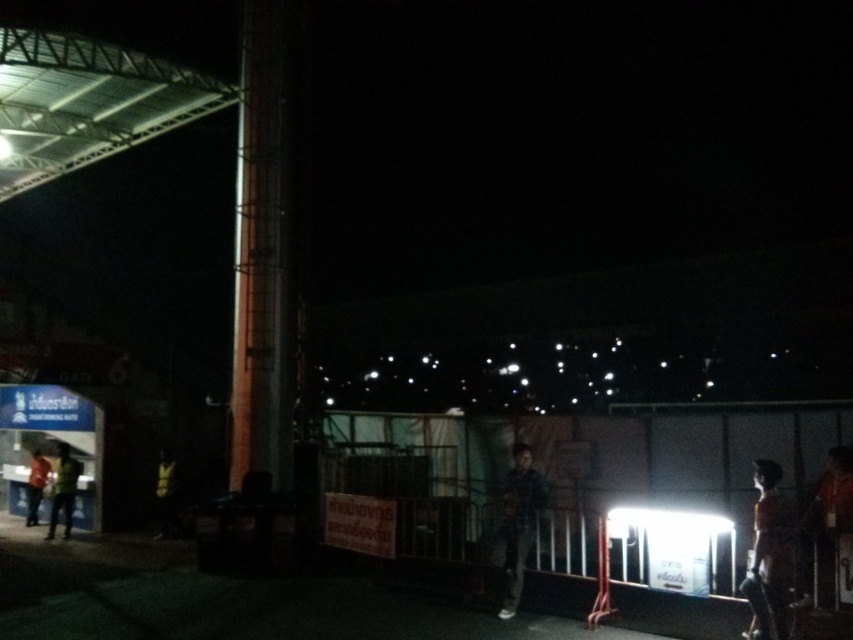
Question: Can you confirm if orange fabric shirt at right is bigger than orange shirt at left?

Choices:
 (A) yes
 (B) no

Answer: (B)

Question: Which object is closer to the camera taking this photo?

Choices:
 (A) blue plastic signboard at lower left
 (B) plaid fabric shirt at center

Answer: (B)

Question: In this image, where is blue plastic signboard at lower left located relative to orange fabric shirt at right?

Choices:
 (A) right
 (B) left

Answer: (B)

Question: Does orange fabric shirt at right have a smaller size compared to plaid fabric shirt at center?

Choices:
 (A) yes
 (B) no

Answer: (B)

Question: Which of these objects is positioned closest to the green fabric jacket at left?

Choices:
 (A) blue plastic signboard at lower left
 (B) plaid fabric shirt at center
 (C) orange shirt at left
 (D) orange fabric shirt at right

Answer: (A)

Question: Which object is the closest to the green fabric jacket at left?

Choices:
 (A) dark fabric jacket at left
 (B) blue plastic signboard at lower left
 (C) orange shirt at left

Answer: (B)